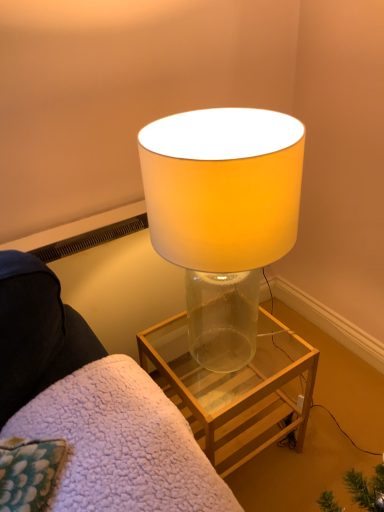
Question: Should I look upward or downward to see clear glass table at center?

Choices:
 (A) down
 (B) up

Answer: (A)

Question: Is transparent glass lamp at center looking in the opposite direction of clear glass table at center?

Choices:
 (A) yes
 (B) no

Answer: (B)

Question: Is transparent glass lamp at center next to clear glass table at center?

Choices:
 (A) no
 (B) yes

Answer: (A)

Question: Are transparent glass lamp at center and clear glass table at center far apart?

Choices:
 (A) yes
 (B) no

Answer: (B)

Question: Is transparent glass lamp at center thinner than clear glass table at center?

Choices:
 (A) yes
 (B) no

Answer: (B)

Question: From a real-world perspective, is transparent glass lamp at center on top of clear glass table at center?

Choices:
 (A) no
 (B) yes

Answer: (B)

Question: Is transparent glass lamp at center to the left of clear glass table at center from the viewer's perspective?

Choices:
 (A) no
 (B) yes

Answer: (B)

Question: Is transparent glass lamp at center taller than translucent glass lamp at center?

Choices:
 (A) yes
 (B) no

Answer: (B)

Question: From the image's perspective, would you say transparent glass lamp at center is shown under translucent glass lamp at center?

Choices:
 (A) yes
 (B) no

Answer: (A)

Question: Is transparent glass lamp at center smaller than translucent glass lamp at center?

Choices:
 (A) yes
 (B) no

Answer: (A)

Question: From the image's perspective, is transparent glass lamp at center on top of translucent glass lamp at center?

Choices:
 (A) no
 (B) yes

Answer: (A)

Question: Does transparent glass lamp at center contain translucent glass lamp at center?

Choices:
 (A) no
 (B) yes

Answer: (A)

Question: From a real-world perspective, does transparent glass lamp at center stand above translucent glass lamp at center?

Choices:
 (A) no
 (B) yes

Answer: (A)

Question: Considering the relative positions of translucent glass lamp at center and transparent glass lamp at center in the image provided, is translucent glass lamp at center to the left of transparent glass lamp at center from the viewer's perspective?

Choices:
 (A) no
 (B) yes

Answer: (A)